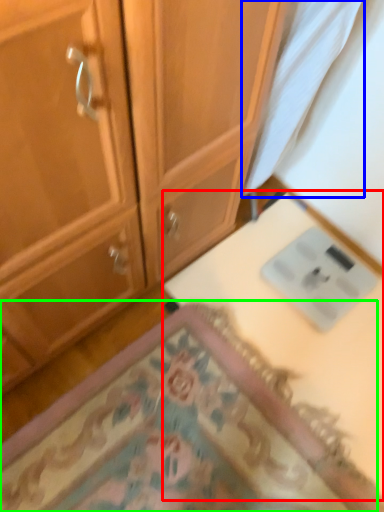
Question: Based on their relative distances, which object is farther from table (highlighted by a red box)? Choose from fabric (highlighted by a blue box) and mat (highlighted by a green box).

Choices:
 (A) fabric
 (B) mat

Answer: (A)